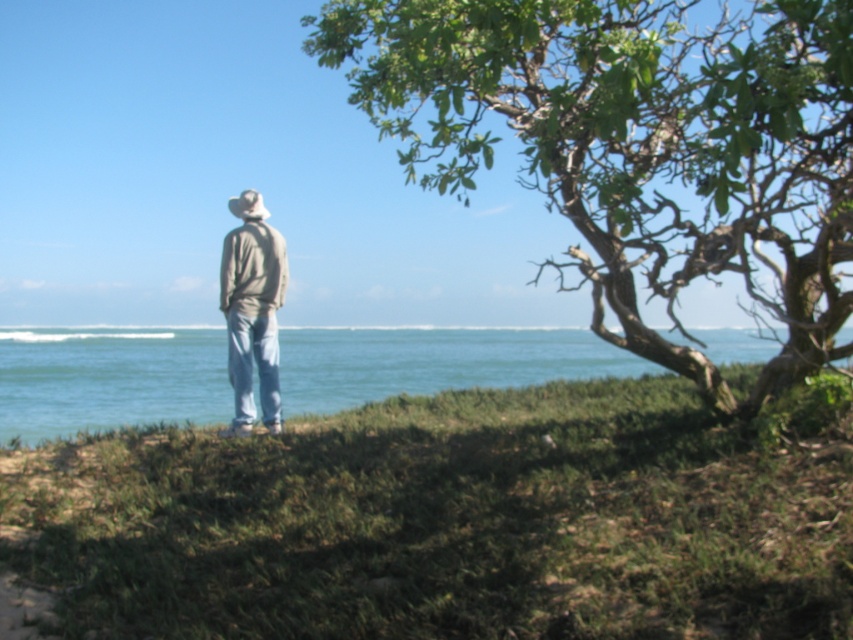
You are a photographer planning to take a picture of the coastal scene. You notice the green leafy tree at upper right and the light gray cotton jacket at center. Which object should you focus on if you want to capture the larger subject in your shot?

The light gray cotton jacket at center should be focused on because it occupies more space than the green leafy tree at upper right.

You are a photographer planning to capture a landscape photo of the coastal scene. You want to ensure that both the green grass at lower center and the light gray cotton jacket at center are clearly visible in the frame. Which object should you focus on first to ensure both are in focus?

The green grass at lower center is bigger than the light gray cotton jacket at center, so focusing on the larger object first will help ensure both are in focus.